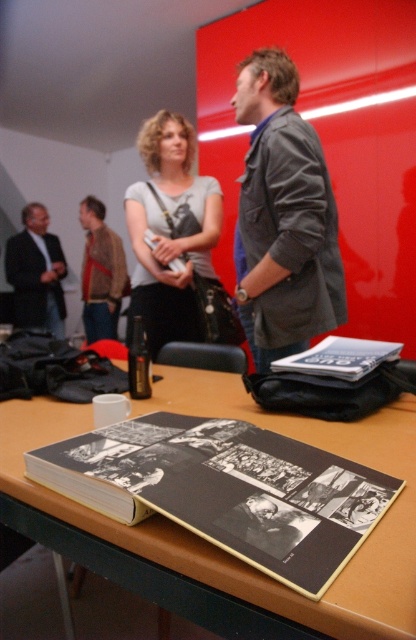
You are an assistant organizing a photoshoot. You need to position the matte gray shirt at center and the matte black suit at left in a way that follows the spatial arrangement shown in the image. Which object should be placed lower when arranging them?

The matte gray shirt at center should be placed lower than the matte black suit at left because it is located below it in the image.

You are organizing items on a table in a meeting room with a red wall. You need to place a new item exactly where the matte gray shirt at center is currently located. Is there enough space for the new item without overlapping any other objects?

The matte gray shirt at center is located at point (170, 230), so yes, there is enough space to place the new item there without overlapping other objects as long as the new item fits within those coordinates.